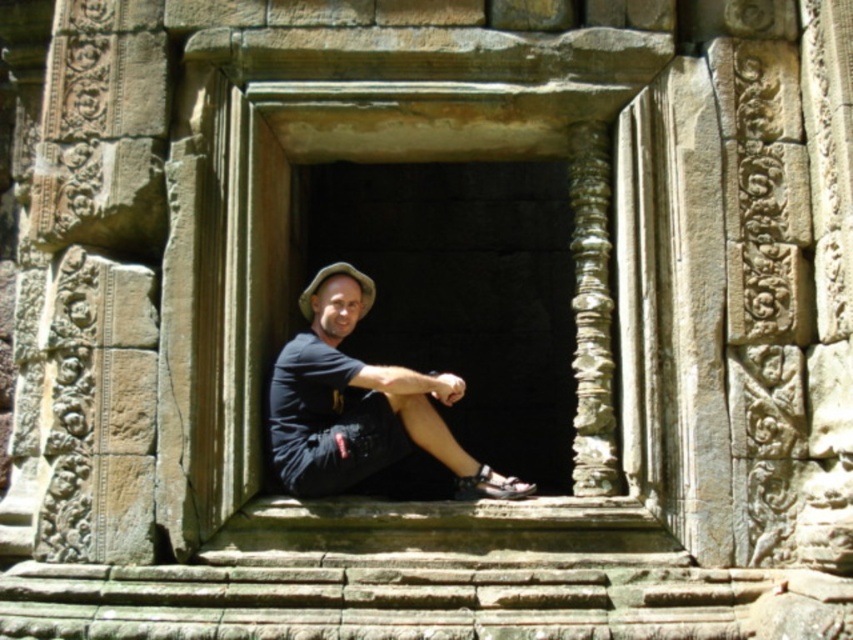
You are a photographer trying to capture the man in the scene. To ensure the stone textured window at center is visible in the background behind the black matte shirt at center, where should you position the camera relative to the man?

The stone textured window at center is above the black matte shirt at center, so you should position the camera above the man to capture the window behind the shirt.

You are a photographer trying to capture the stone window frame in the center. You notice a specific point marked at coordinates (325, 161). Where exactly is this point located in relation to the stone textured window at center?

The point at coordinates (325, 161) marks the location of the stone textured window at center.